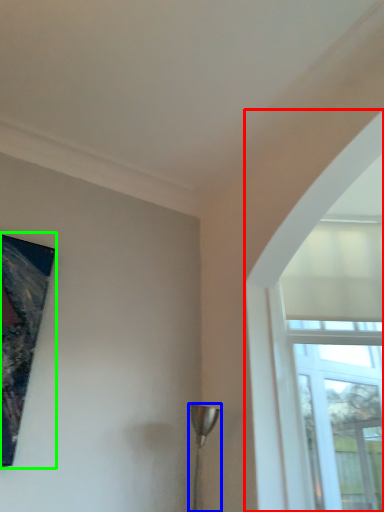
Question: Based on their relative distances, which object is farther from window (highlighted by a red box)? Choose from lamp (highlighted by a blue box) and picture frame (highlighted by a green box).

Choices:
 (A) lamp
 (B) picture frame

Answer: (B)